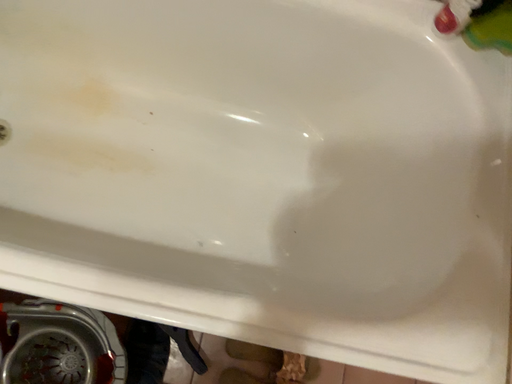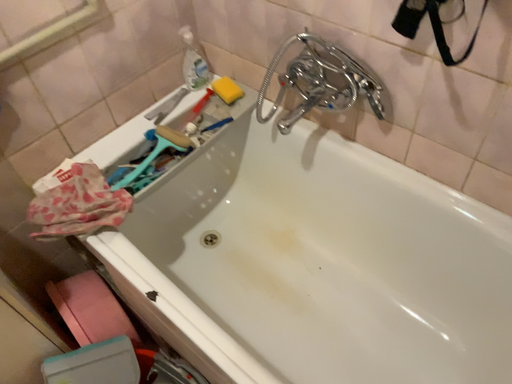
Question: How did the camera likely rotate when shooting the video?

Choices:
 (A) rotated right
 (B) rotated left

Answer: (B)